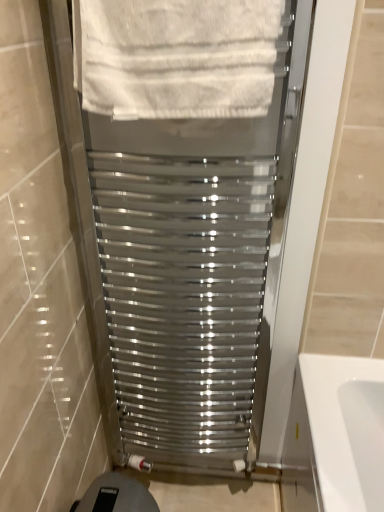
Image resolution: width=384 pixels, height=512 pixels. Describe the element at coordinates (176, 57) in the screenshot. I see `white textured towel at upper center` at that location.

Find the location of a particular element. white textured towel at upper center is located at coordinates (176, 57).

You are a GUI agent. You are given a task and a screenshot of the screen. Output one action in this format:
    pyautogui.click(x=<x>, y=<y>)
    Task: Click on the white textured towel at upper center
    Image resolution: width=384 pixels, height=512 pixels.
    Given the screenshot: What is the action you would take?
    pyautogui.click(x=176, y=57)